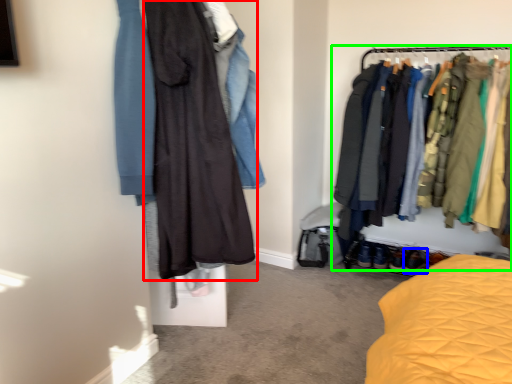
Question: Which object is positioned closest to fancy dress (highlighted by a red box)? Select from footwear (highlighted by a blue box) and closet (highlighted by a green box).

Choices:
 (A) footwear
 (B) closet

Answer: (B)